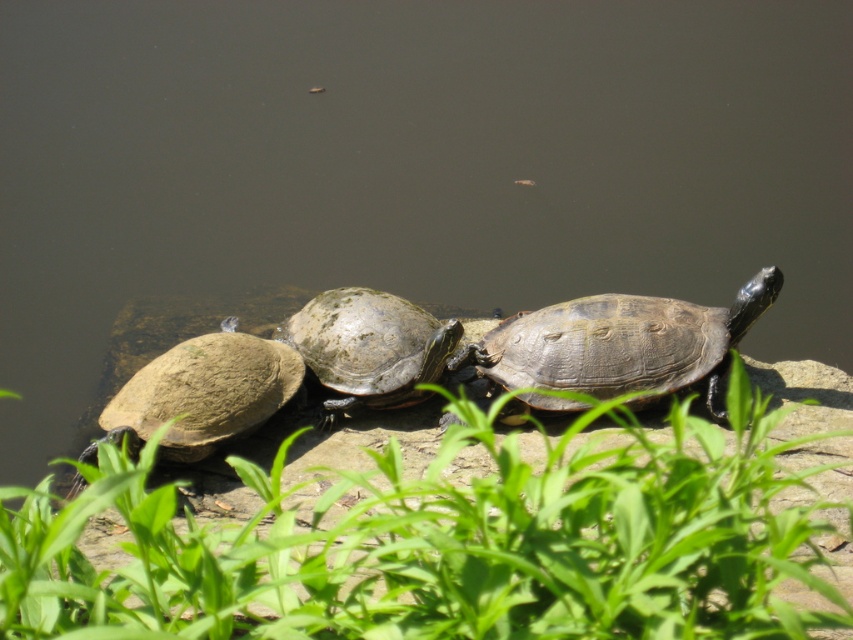
Consider the image. Can you confirm if green leafy grass at center is positioned to the left of greenish-brown textured shell at center?

In fact, green leafy grass at center is to the right of greenish-brown textured shell at center.

Is green leafy grass at center in front of greenish-brown textured shell at center?

Yes, it is.

I want to click on green leafy grass at center, so (445, 545).

Is shiny dark brown tortoise at center below brown matte tortoise at left?

Actually, shiny dark brown tortoise at center is above brown matte tortoise at left.

Can you confirm if shiny dark brown tortoise at center is shorter than brown matte tortoise at left?

No, shiny dark brown tortoise at center is not shorter than brown matte tortoise at left.

Is point (554, 326) positioned after point (270, 388)?

That is True.

The height and width of the screenshot is (640, 853). Find the location of `shiny dark brown tortoise at center`. shiny dark brown tortoise at center is located at coordinates (619, 346).

Which is behind, point (247, 339) or point (384, 369)?

Positioned behind is point (247, 339).

Between brown matte tortoise at left and greenish-brown textured shell at center, which one is positioned higher?

greenish-brown textured shell at center

Image resolution: width=853 pixels, height=640 pixels. Describe the element at coordinates (202, 394) in the screenshot. I see `brown matte tortoise at left` at that location.

Locate an element on the screen. This screenshot has width=853, height=640. brown matte tortoise at left is located at coordinates (202, 394).